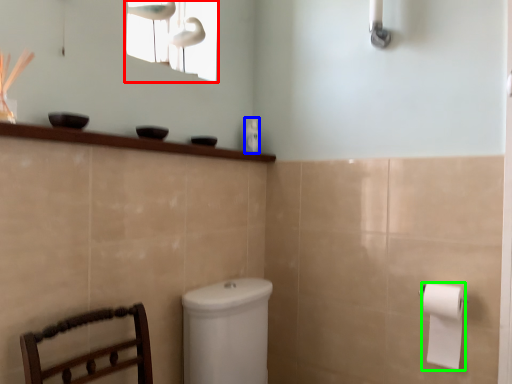
Question: Based on their relative distances, which object is farther from window screen (highlighted by a red box)? Choose from toiletry (highlighted by a blue box) and toilet paper (highlighted by a green box).

Choices:
 (A) toiletry
 (B) toilet paper

Answer: (B)